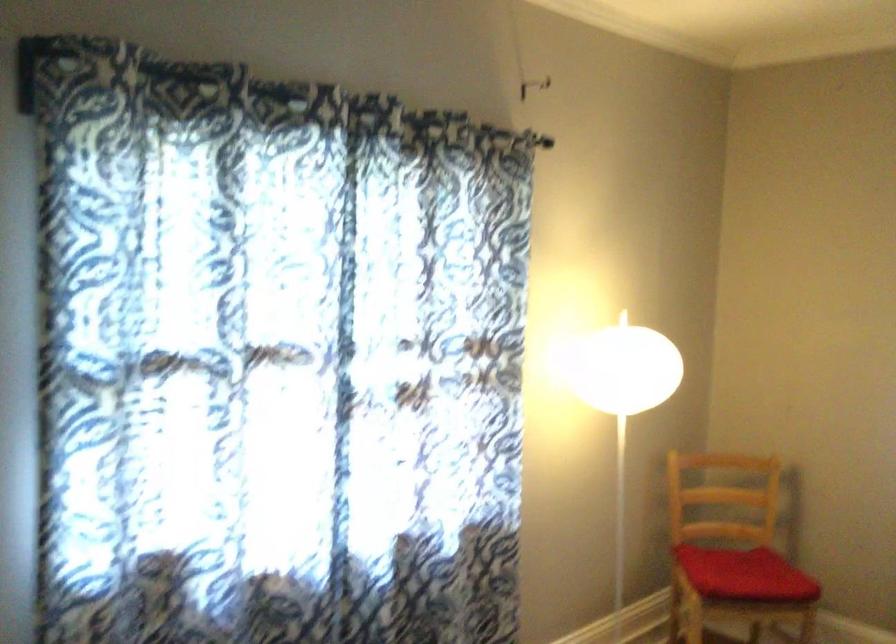
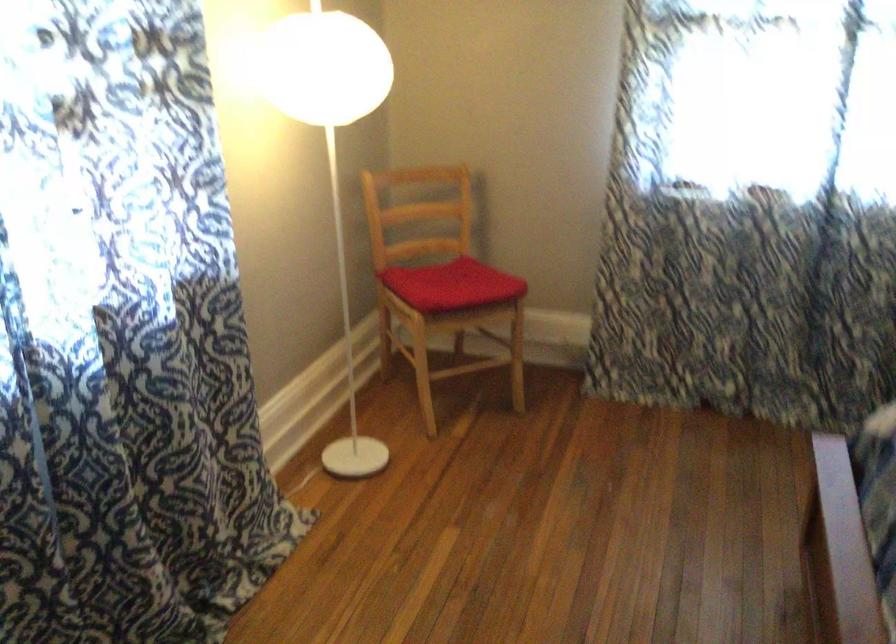
From the picture: The first image is from the beginning of the video and the second image is from the end. How did the camera likely rotate when shooting the video?

The rotation direction of the camera is right-down.